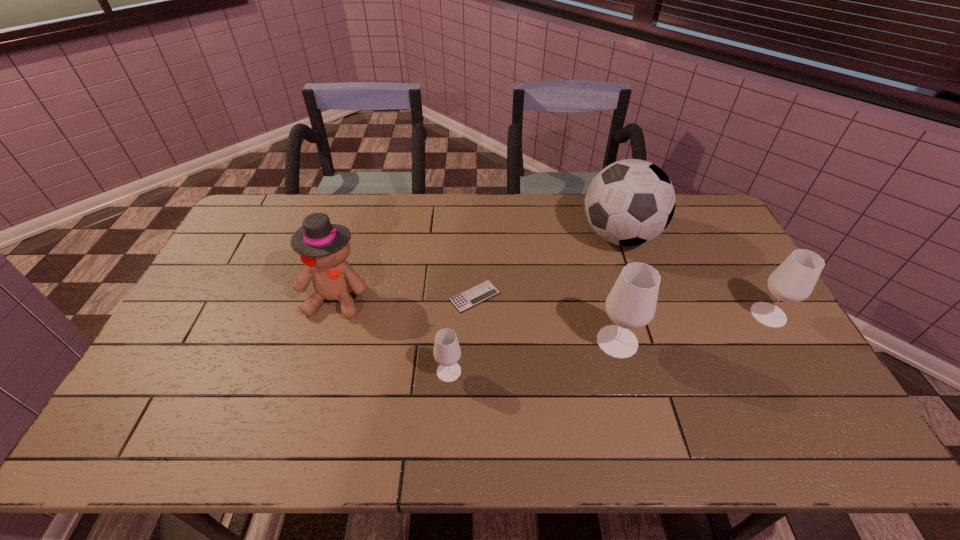
Identify the location of vacant region that satisfies the following two spatial constraints: 1. on the front-facing side of the second glass from left to right; 2. on the left side of the rag_doll. The height and width of the screenshot is (540, 960). (324, 341).

The image size is (960, 540). I want to click on free point that satisfies the following two spatial constraints: 1. on the main logo of the soccer ball; 2. on the front side of the nearest object, so click(x=665, y=372).

At what (x,y) coordinates should I click in order to perform the action: click on free point that satisfies the following two spatial constraints: 1. on the front-facing side of the rag_doll; 2. on the right side of the second glass from right to left. Please return your answer as a coordinate pair (x, y). The height and width of the screenshot is (540, 960). Looking at the image, I should click on (324, 341).

At what (x,y) coordinates should I click in order to perform the action: click on vacant region that satisfies the following two spatial constraints: 1. on the main logo of the farthest object; 2. on the front-facing side of the leftmost object. Please return your answer as a coordinate pair (x, y). This screenshot has height=540, width=960. Looking at the image, I should click on (640, 297).